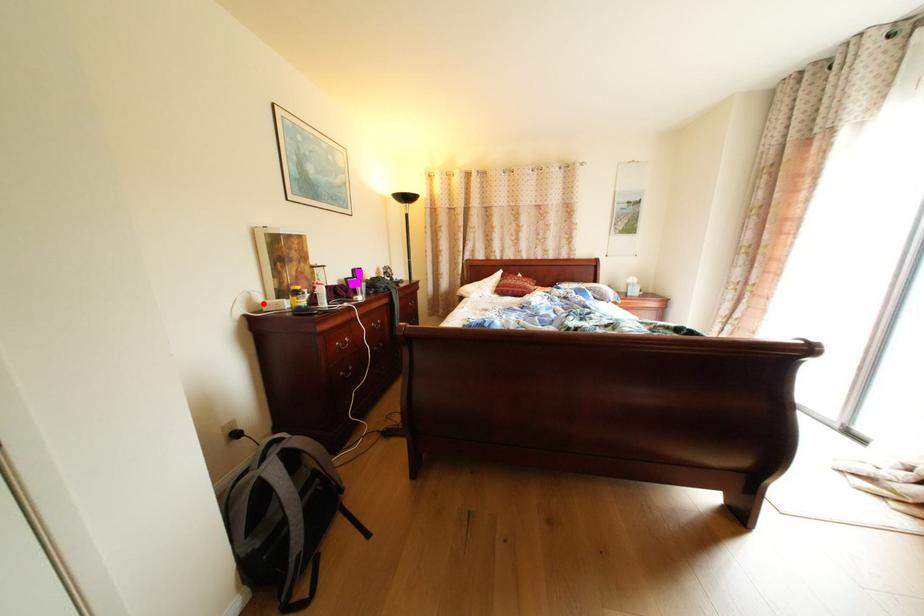
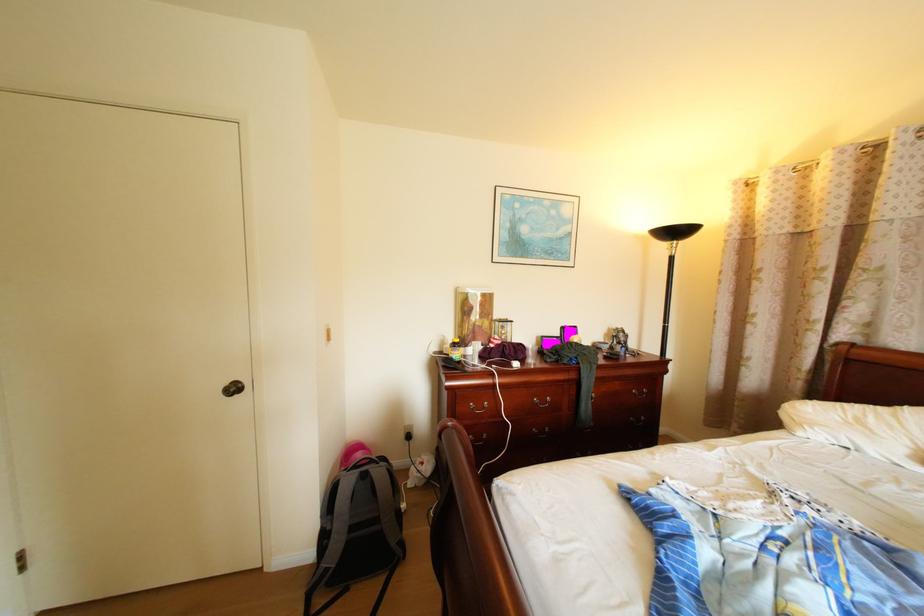
In the second image, find the point that corresponds to the highlighted location in the first image.

(456, 345)